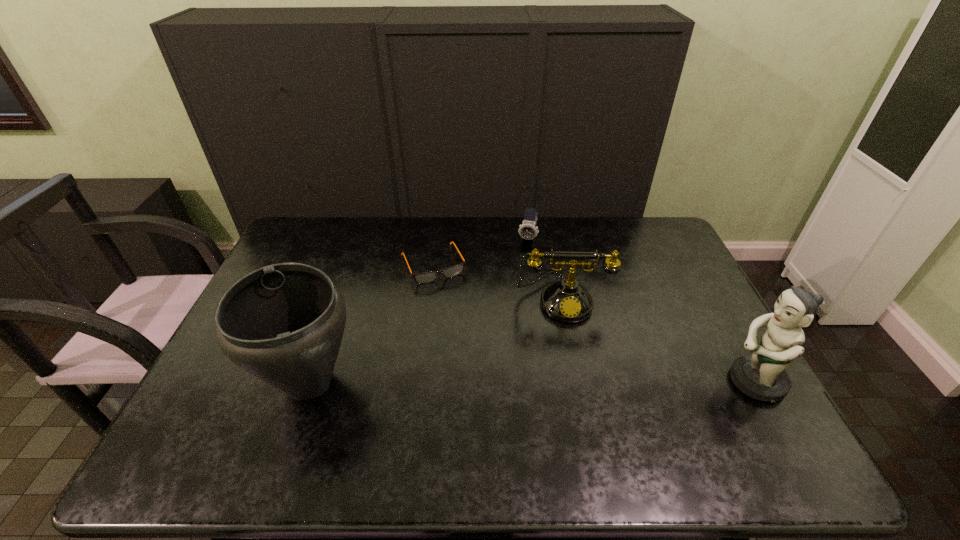
Identify the location of blank space that satisfies the following two spatial constraints: 1. on the front side of the shortest object; 2. on the right side of the telephone. The height and width of the screenshot is (540, 960). (428, 299).

The height and width of the screenshot is (540, 960). Find the location of `vacant space that satisfies the following two spatial constraints: 1. on the back side of the leftmost object; 2. on the left side of the spectacles`. vacant space that satisfies the following two spatial constraints: 1. on the back side of the leftmost object; 2. on the left side of the spectacles is located at coordinates (350, 264).